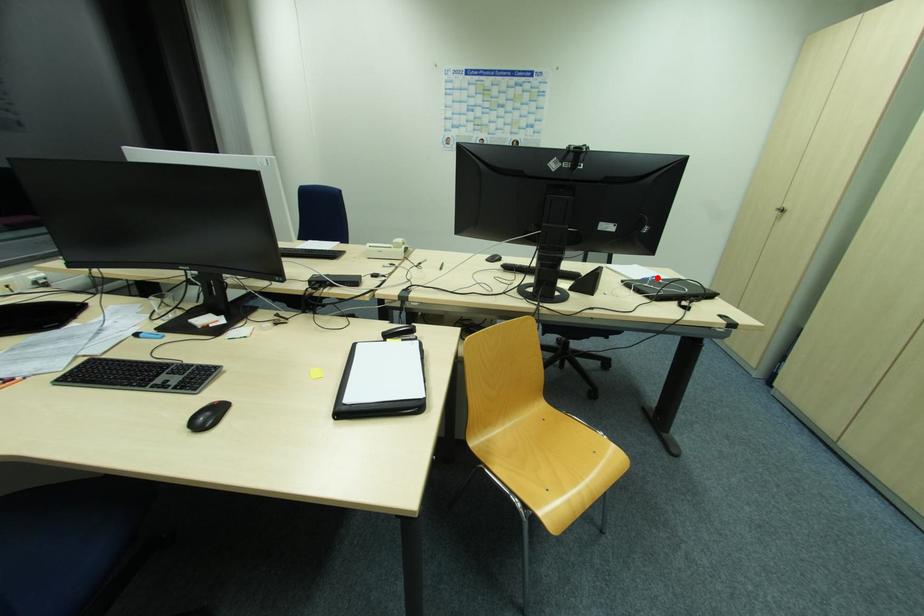
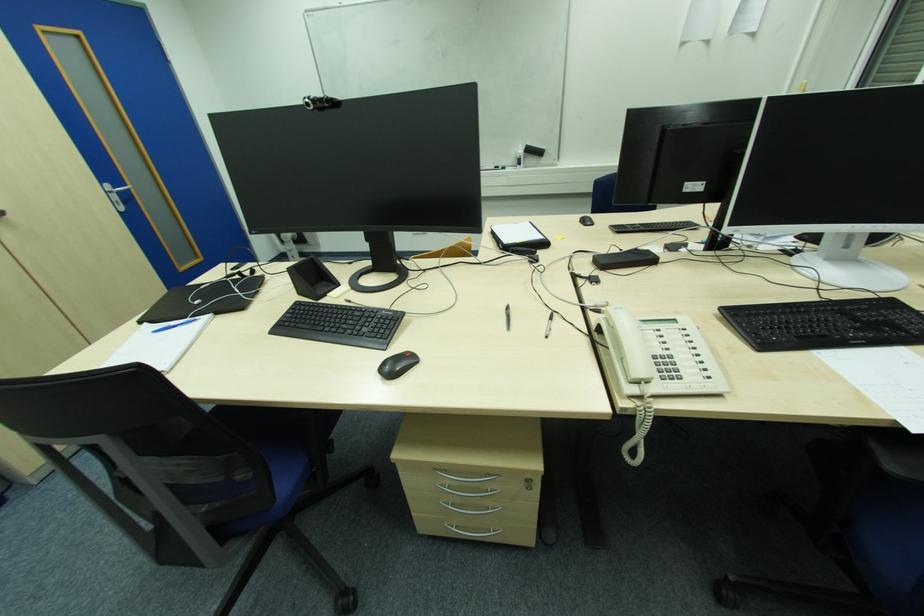
The point at the highlighted location is marked in the first image. Where is the corresponding point in the second image?

(156, 333)